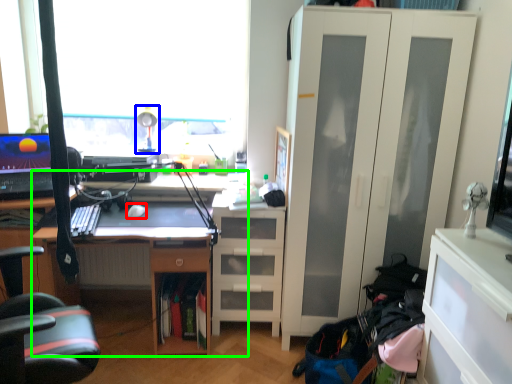
Question: Which object is positioned farthest from mouse (highlighted by a red box)? Select from table lamp (highlighted by a blue box) and desk (highlighted by a green box).

Choices:
 (A) table lamp
 (B) desk

Answer: (A)